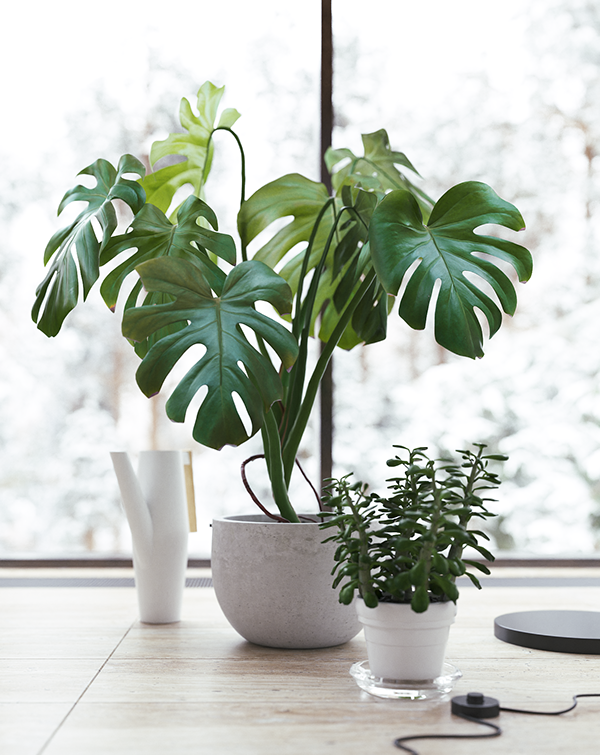
Locate an element on the screen. This screenshot has height=755, width=600. white plant pot is located at coordinates (394, 642).